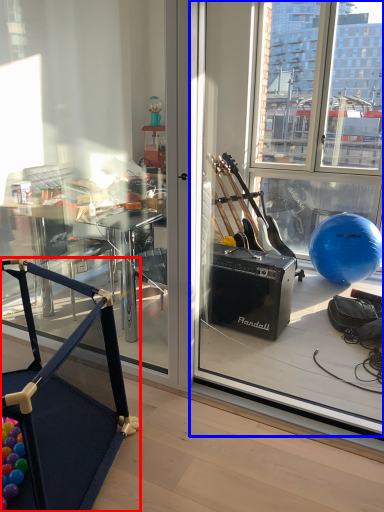
Question: Which of the following is the farthest to the observer, furniture (highlighted by a red box) or window screen (highlighted by a blue box)?

Choices:
 (A) furniture
 (B) window screen

Answer: (B)